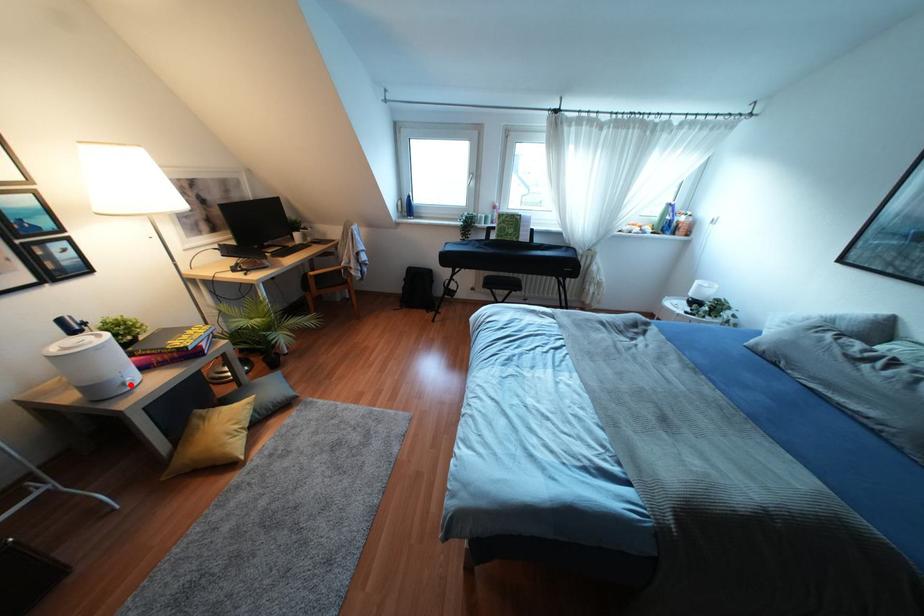
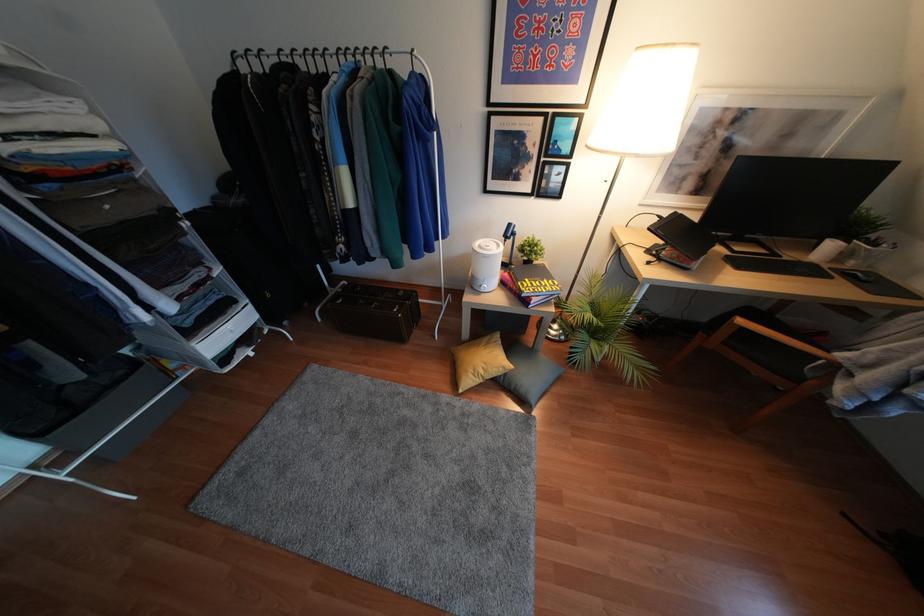
In the second image, find the point that corresponds to the highlighted location in the first image.

(481, 290)